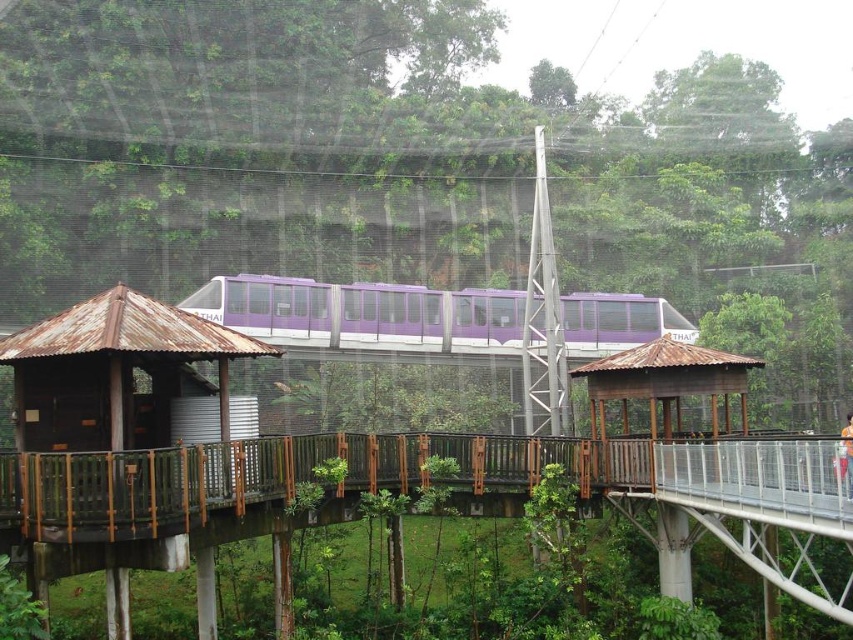
In the scene shown: You are a park ranger checking the dimensions of the structures in the forest scene. The rusty wood hut at left and the purple matte train at center are both in your line of sight. Which structure has a smaller width?

The rusty wood hut at left is thinner than the purple matte train at center, so the rusty wood hut at left has a smaller width.

In the scene shown: You are standing at the wooden walkway in the forest and see two points marked in the scene. Which point, point (772, 557) or point (473, 346), is closer to you?

Point (772, 557) is closer to you than point (473, 346).